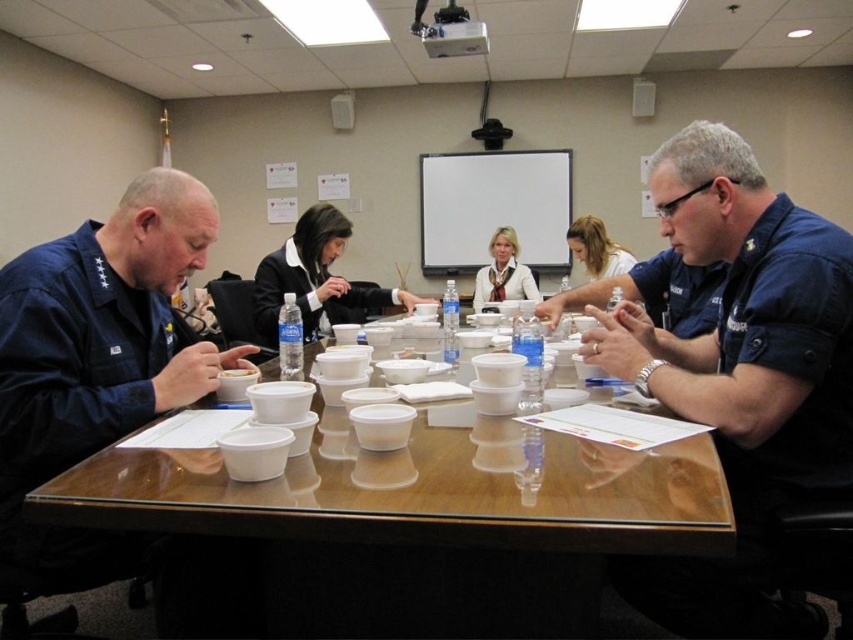
You are sitting at the wooden table at center and want to place a coffee mug on the surface. Is the black fabric jacket at center in your way?

The wooden table at center is below the black fabric jacket at center, so the jacket is resting on the table. This means the black fabric jacket at center is in your way, so you cannot place the mug directly underneath it.

You are a photographer preparing to take a group photo of the participants around the conference table. You notice the black fabric jacket at center and the matte white blouse at center. Which one should you focus on first if you want to capture the leftmost clothing item in the scene?

The black fabric jacket at center is positioned on the left side of the matte white blouse at center, so you should focus on the black fabric jacket at center first to capture the leftmost clothing item.